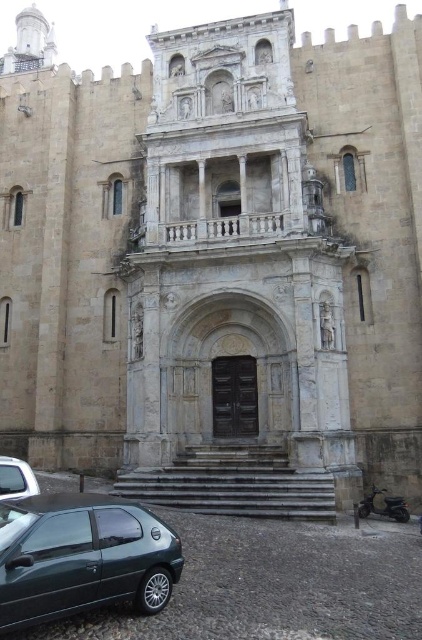
Question: Which object is closer to the camera taking this photo?

Choices:
 (A) metallic green hatchback at lower left
 (B) silver metallic car at lower left

Answer: (A)

Question: Among these points, which one is farthest from the camera?

Choices:
 (A) (11, 474)
 (B) (75, 577)

Answer: (A)

Question: Considering the relative positions of metallic green hatchback at lower left and silver metallic car at lower left in the image provided, where is metallic green hatchback at lower left located with respect to silver metallic car at lower left?

Choices:
 (A) left
 (B) right

Answer: (B)

Question: Is the position of metallic green hatchback at lower left more distant than that of silver metallic car at lower left?

Choices:
 (A) yes
 (B) no

Answer: (B)

Question: Can you confirm if metallic green hatchback at lower left is positioned to the left of silver metallic car at lower left?

Choices:
 (A) no
 (B) yes

Answer: (A)